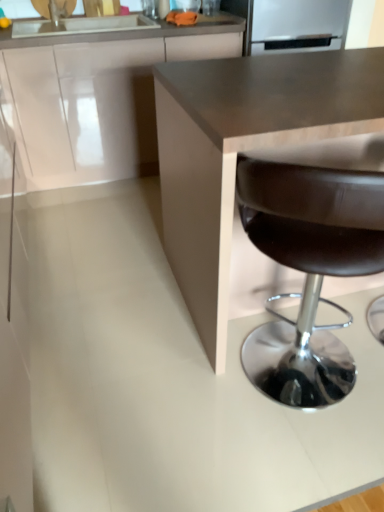
Question: Is white glossy cabinet at upper left further to the viewer compared to brown leather stool at lower right?

Choices:
 (A) yes
 (B) no

Answer: (A)

Question: From a real-world perspective, is white glossy cabinet at upper left located beneath brown leather stool at lower right?

Choices:
 (A) no
 (B) yes

Answer: (A)

Question: Is white glossy cabinet at upper left looking in the opposite direction of brown leather stool at lower right?

Choices:
 (A) yes
 (B) no

Answer: (B)

Question: Is white glossy cabinet at upper left closer to the viewer compared to brown leather stool at lower right?

Choices:
 (A) yes
 (B) no

Answer: (B)

Question: Does white glossy cabinet at upper left have a lesser height compared to brown leather stool at lower right?

Choices:
 (A) yes
 (B) no

Answer: (A)

Question: From the image's perspective, relative to white glossy cabinet at upper left, is brown leather stool at lower right above or below?

Choices:
 (A) below
 (B) above

Answer: (A)

Question: Considering the positions of point (289, 204) and point (8, 164), is point (289, 204) closer or farther from the camera than point (8, 164)?

Choices:
 (A) closer
 (B) farther

Answer: (A)

Question: From their relative heights in the image, would you say brown leather stool at lower right is taller or shorter than white glossy cabinet at upper left?

Choices:
 (A) short
 (B) tall

Answer: (B)

Question: From a real-world perspective, relative to white glossy cabinet at upper left, is brown leather stool at lower right vertically above or below?

Choices:
 (A) below
 (B) above

Answer: (A)

Question: From a real-world perspective, is satin silver refrigerator at upper center above or below brown leather stool at lower right?

Choices:
 (A) below
 (B) above

Answer: (B)

Question: From the image's perspective, is satin silver refrigerator at upper center located above or below brown leather stool at lower right?

Choices:
 (A) below
 (B) above

Answer: (B)

Question: In terms of size, does satin silver refrigerator at upper center appear bigger or smaller than brown leather stool at lower right?

Choices:
 (A) small
 (B) big

Answer: (A)

Question: Relative to brown leather stool at lower right, is satin silver refrigerator at upper center in front or behind?

Choices:
 (A) front
 (B) behind

Answer: (B)

Question: From a real-world perspective, relative to brown leather stool at lower right, is white glossy cabinet at upper left vertically above or below?

Choices:
 (A) below
 (B) above

Answer: (B)

Question: Looking at their shapes, would you say white glossy cabinet at upper left is wider or thinner than brown leather stool at lower right?

Choices:
 (A) thin
 (B) wide

Answer: (B)